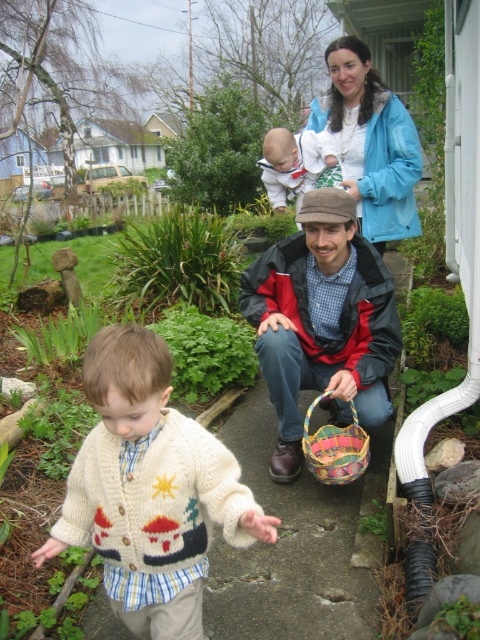
Does white fleece jacket at upper center have a lesser height compared to multicolored woven basket at lower center?

No, white fleece jacket at upper center is not shorter than multicolored woven basket at lower center.

Does white fleece jacket at upper center have a larger size compared to multicolored woven basket at lower center?

Yes.

This screenshot has height=640, width=480. What do you see at coordinates (294, 163) in the screenshot? I see `white fleece jacket at upper center` at bounding box center [294, 163].

Locate an element on the screen. The height and width of the screenshot is (640, 480). white fleece jacket at upper center is located at coordinates (294, 163).

Image resolution: width=480 pixels, height=640 pixels. What do you see at coordinates (322, 321) in the screenshot?
I see `red and black jacket at center` at bounding box center [322, 321].

Can you confirm if red and black jacket at center is taller than multicolored woven basket at lower center?

Yes.

Which is in front, point (331, 332) or point (313, 458)?

Point (313, 458) is in front.

At what (x,y) coordinates should I click in order to perform the action: click on red and black jacket at center. Please return your answer as a coordinate pair (x, y). Looking at the image, I should click on (322, 321).

Which is more to the right, red and black jacket at center or blue fabric jacket at upper center?

Positioned to the right is blue fabric jacket at upper center.

Which of these two, red and black jacket at center or blue fabric jacket at upper center, stands shorter?

blue fabric jacket at upper center

The image size is (480, 640). What do you see at coordinates (322, 321) in the screenshot?
I see `red and black jacket at center` at bounding box center [322, 321].

You are a GUI agent. You are given a task and a screenshot of the screen. Output one action in this format:
    pyautogui.click(x=<x>, y=<y>)
    Task: Click on the red and black jacket at center
    The height and width of the screenshot is (640, 480).
    Given the screenshot: What is the action you would take?
    pyautogui.click(x=322, y=321)